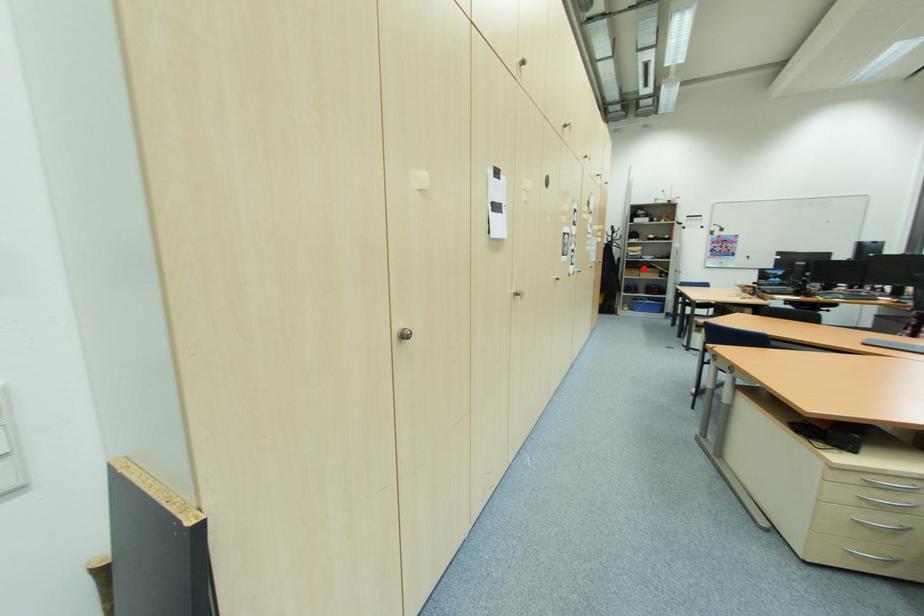
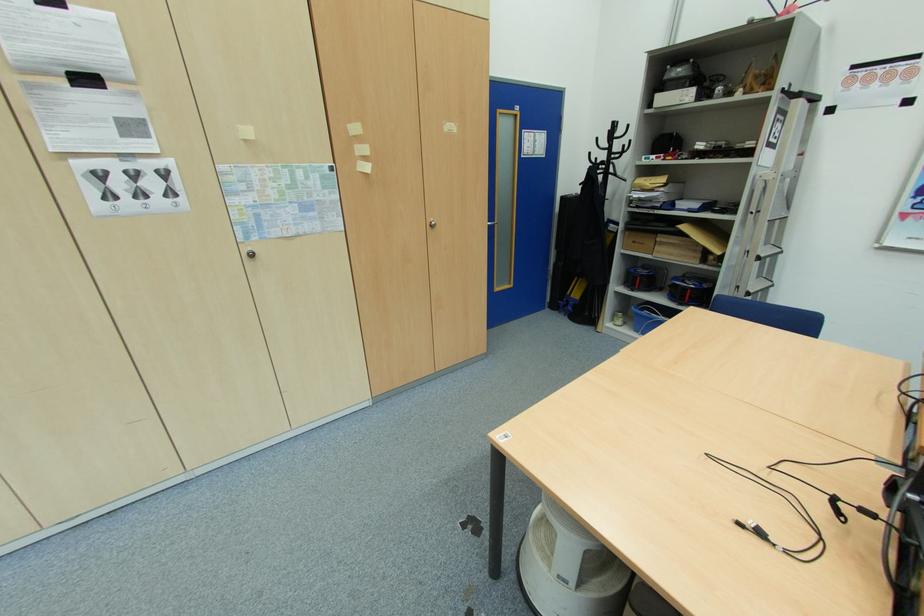
In the second image, find the point that corresponds to the highlighted location in the first image.

(660, 233)